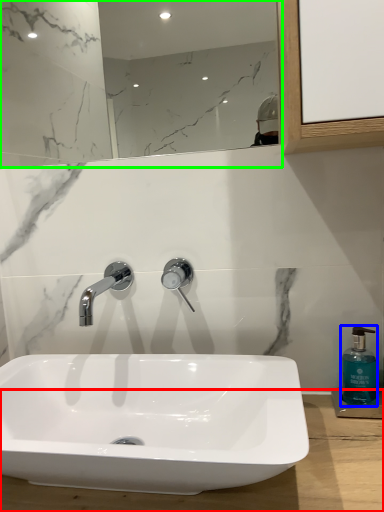
Question: Which is nearer to the counter top (highlighted by a red box)? soap dispenser (highlighted by a blue box) or mirror (highlighted by a green box).

Choices:
 (A) soap dispenser
 (B) mirror

Answer: (A)